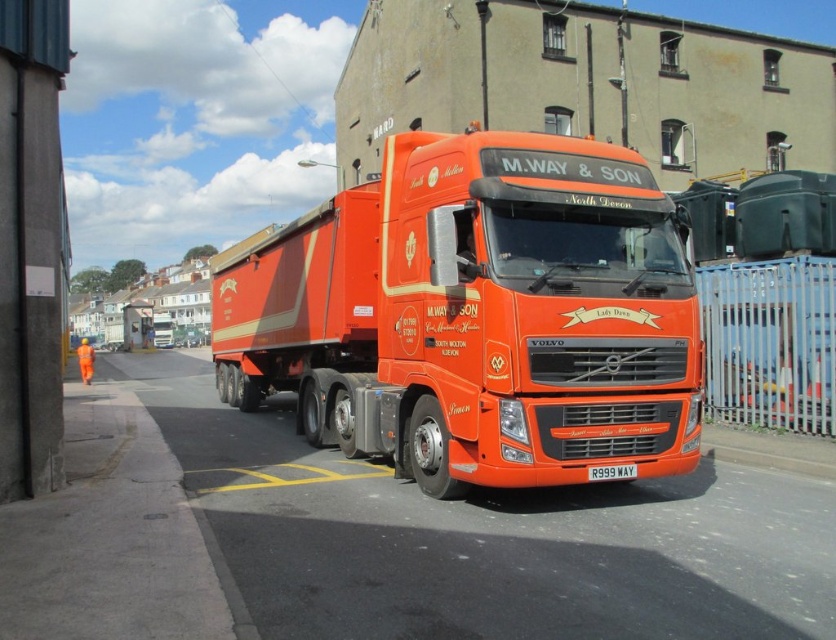
Is matte orange truck at center bigger than white plastic license plate at center?

Yes.

Is matte orange truck at center thinner than white plastic license plate at center?

In fact, matte orange truck at center might be wider than white plastic license plate at center.

Between point (375, 369) and point (595, 476), which one is positioned in front?

Point (595, 476) is in front.

You are a GUI agent. You are given a task and a screenshot of the screen. Output one action in this format:
    pyautogui.click(x=<x>, y=<y>)
    Task: Click on the matte orange truck at center
    The image size is (836, 640).
    Given the screenshot: What is the action you would take?
    pyautogui.click(x=477, y=314)